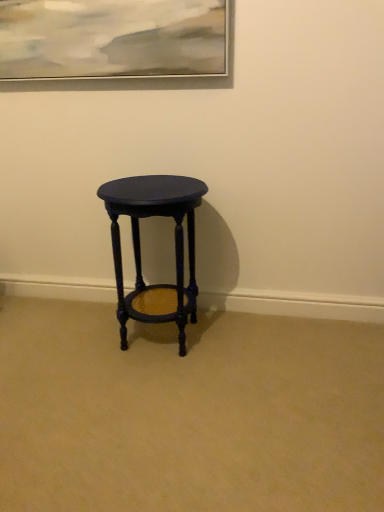
What is the approximate width of matte black stool at center?

15.73 inches.

Identify the location of matte black stool at center. Image resolution: width=384 pixels, height=512 pixels. (140, 247).

The image size is (384, 512). Describe the element at coordinates (140, 247) in the screenshot. I see `matte black stool at center` at that location.

Find the location of a particular element. The height and width of the screenshot is (512, 384). matte black stool at center is located at coordinates (140, 247).